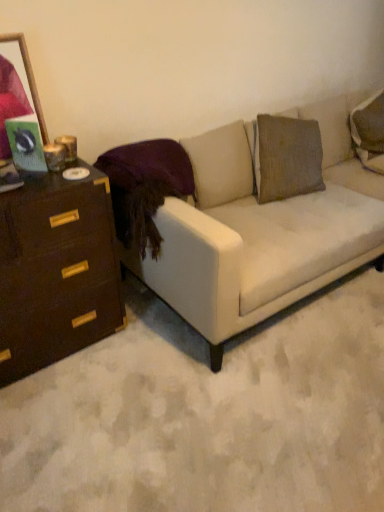
Question: Is wooden picture frame at upper left inside the boundaries of white fabric couch at center, or outside?

Choices:
 (A) outside
 (B) inside

Answer: (A)

Question: Looking at their shapes, would you say wooden picture frame at upper left is wider or thinner than white fabric couch at center?

Choices:
 (A) thin
 (B) wide

Answer: (A)

Question: Which of these objects is positioned farthest from the wooden picture frame at upper left?

Choices:
 (A) white fabric couch at center
 (B) dark brown wood chest of drawers at left
 (C) velvet purple pillow at upper left

Answer: (A)

Question: Estimate the real-world distances between objects in this image. Which object is farther from the white fabric couch at center?

Choices:
 (A) dark brown wood chest of drawers at left
 (B) wooden picture frame at upper left
 (C) velvet purple pillow at upper left

Answer: (B)